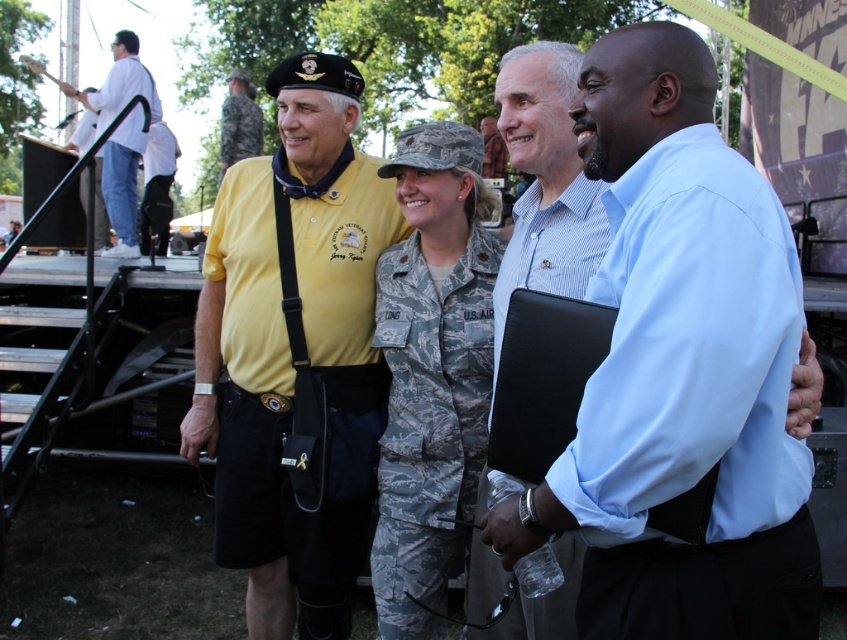
Question: Which point appears closest to the camera in this image?

Choices:
 (A) (266, 625)
 (B) (128, 177)

Answer: (A)

Question: Among these objects, which one is farthest from the camera?

Choices:
 (A) white cotton shirt at upper left
 (B) light blue shirt at center
 (C) yellow shirt at center

Answer: (A)

Question: Which of the following is the farthest from the observer?

Choices:
 (A) white cotton shirt at upper left
 (B) yellow shirt at center
 (C) camouflage fabric uniform at center
 (D) yellow uniform at center

Answer: (D)

Question: Can you confirm if white cotton shirt at upper left is positioned below yellow uniform at center?

Choices:
 (A) yes
 (B) no

Answer: (A)

Question: Can you confirm if yellow shirt at center is thinner than camo uniform at center?

Choices:
 (A) no
 (B) yes

Answer: (A)

Question: Is light blue shirt at center thinner than camouflage fabric uniform at center?

Choices:
 (A) yes
 (B) no

Answer: (B)